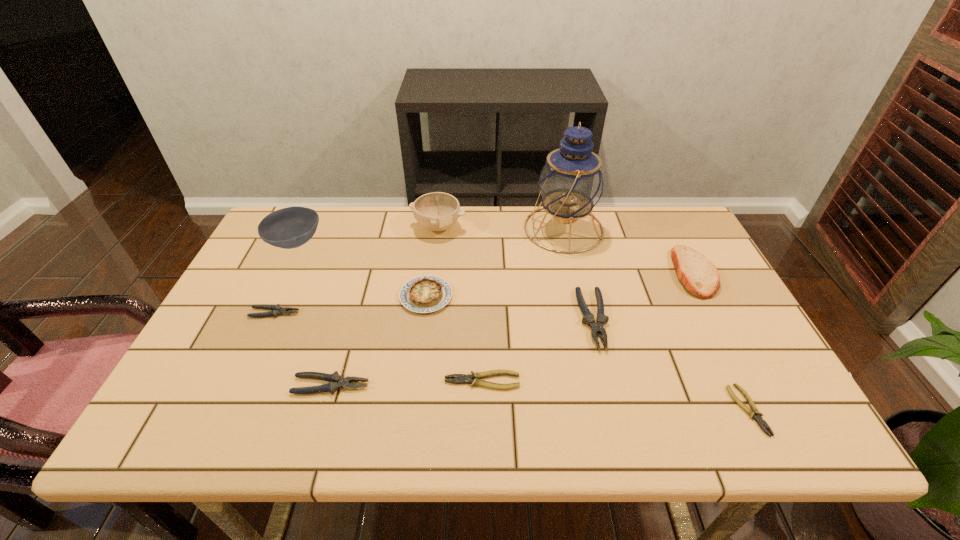
Locate an element on the screen. vacant position located 0.110m on the front of the brown bowl is located at coordinates (273, 288).

The width and height of the screenshot is (960, 540). Find the location of `free region located on the front of the seventh shortest object`. free region located on the front of the seventh shortest object is located at coordinates (774, 425).

This screenshot has height=540, width=960. Identify the location of vacant space located on the back of the quiche. (438, 206).

You are a GUI agent. You are given a task and a screenshot of the screen. Output one action in this format:
    pyautogui.click(x=<x>, y=<y>)
    Task: Click on the vacant area located 0.050m at the gripping part of the rightmost gray pliers
    This screenshot has width=960, height=540.
    Given the screenshot: What is the action you would take?
    pyautogui.click(x=606, y=370)

Where is `free space located at the gripping part of the second smallest gray pliers`? This screenshot has height=540, width=960. free space located at the gripping part of the second smallest gray pliers is located at coordinates (490, 386).

I want to click on vacant space located at the gripping part of the leftmost gray pliers, so click(361, 313).

Locate an element on the screen. Image resolution: width=960 pixels, height=540 pixels. vacant space located 0.310m on the right of the third pliers from right to left is located at coordinates (658, 381).

Identify the location of vacant space situated 0.350m on the back of the shortest object. (683, 278).

The width and height of the screenshot is (960, 540). In order to click on lantern that is at the far edge in this screenshot , I will do `click(571, 183)`.

Find the location of a particular element. The height and width of the screenshot is (540, 960). pita bread located in the far edge section of the desktop is located at coordinates (700, 277).